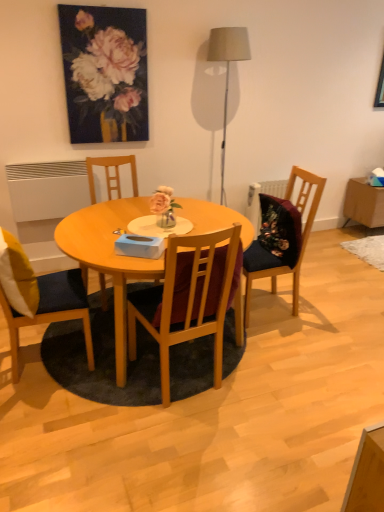
Where is `vacant space in front of wooden chair at center, the 2th chair when ordered from right to left`? The width and height of the screenshot is (384, 512). vacant space in front of wooden chair at center, the 2th chair when ordered from right to left is located at coordinates (184, 439).